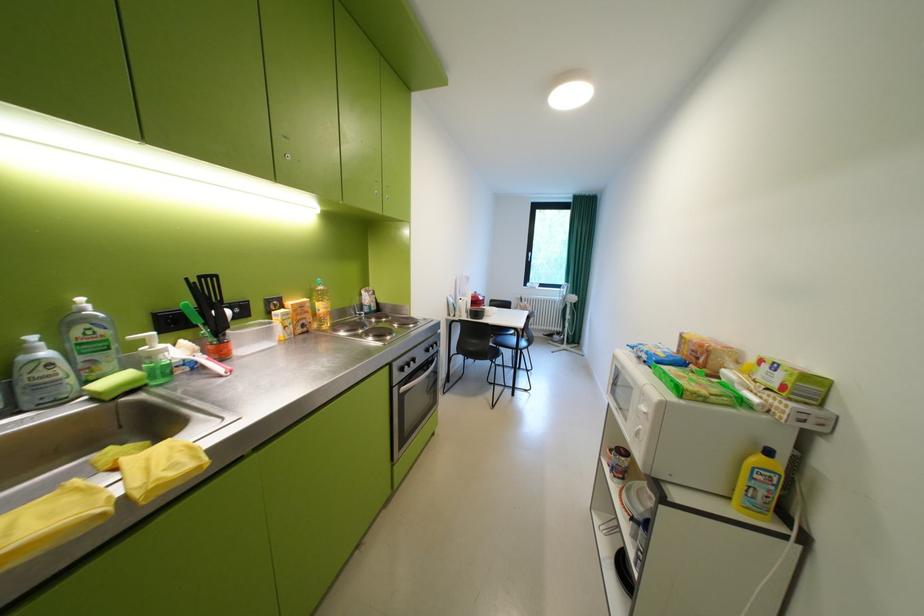
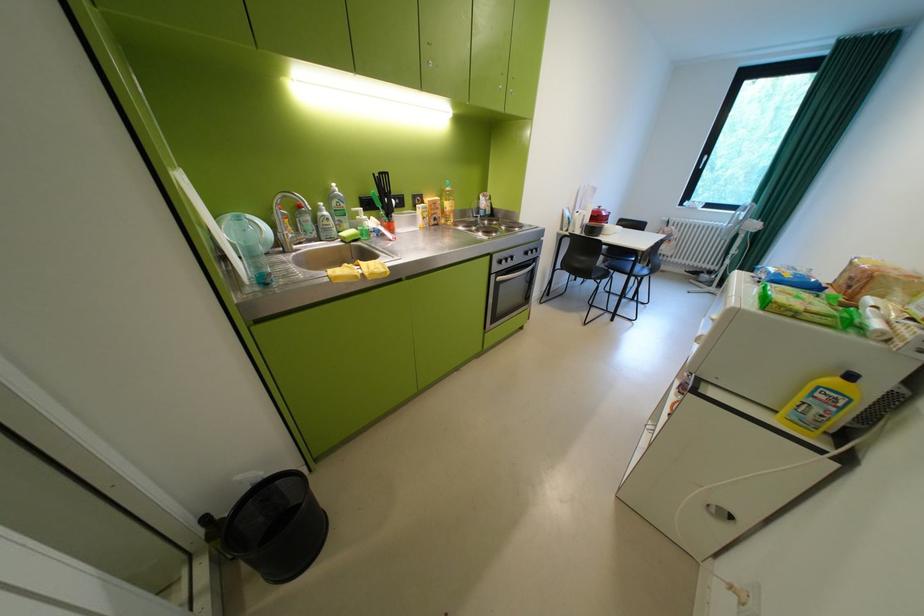
The point at (481,350) is marked in the first image. Where is the corresponding point in the second image?

(587, 265)